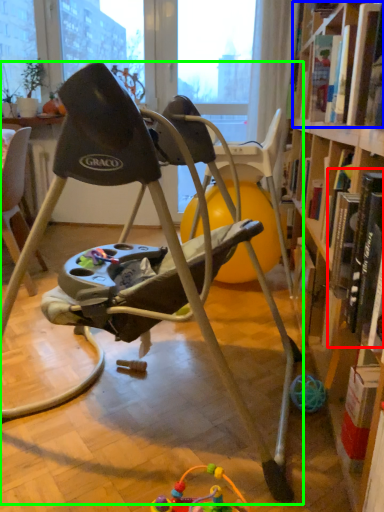
Question: Based on their relative distances, which object is farther from book (highlighted by a red box)? Choose from book (highlighted by a blue box) and chair (highlighted by a green box).

Choices:
 (A) book
 (B) chair

Answer: (A)